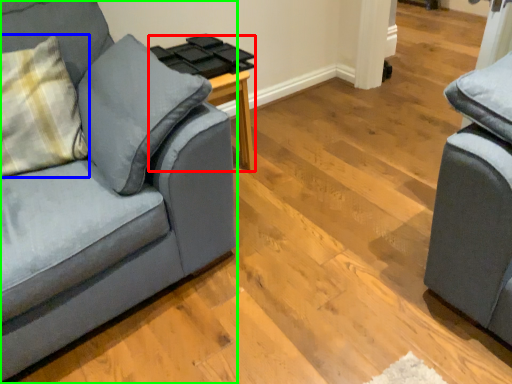
Question: Which object is positioned farthest from side table (highlighted by a red box)? Select from throw pillow (highlighted by a blue box) and studio couch (highlighted by a green box).

Choices:
 (A) throw pillow
 (B) studio couch

Answer: (B)